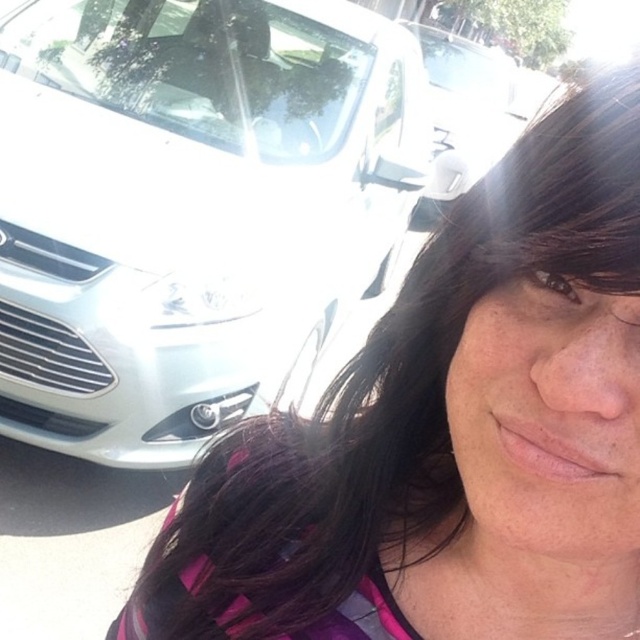
Question: Which object appears closest to the camera in this image?

Choices:
 (A) white glossy car at upper left
 (B) white glossy car at left

Answer: (B)

Question: In this image, where is white glossy car at left located relative to white glossy car at upper left?

Choices:
 (A) above
 (B) below

Answer: (B)

Question: Does white glossy car at left have a greater width compared to white glossy car at upper left?

Choices:
 (A) no
 (B) yes

Answer: (B)

Question: Is white glossy car at left above white glossy car at upper left?

Choices:
 (A) yes
 (B) no

Answer: (B)